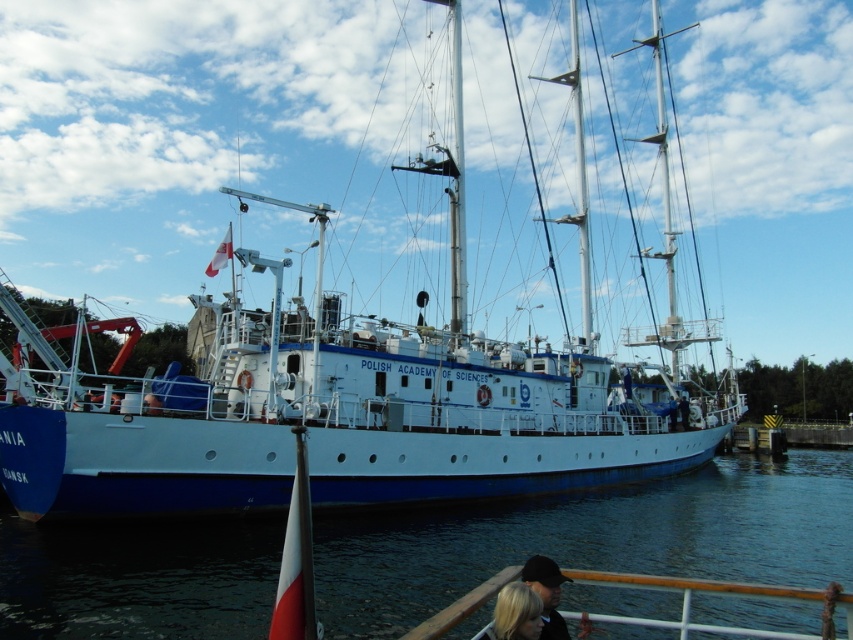
You are a photographer planning to take a photo of the white matte ship at center and the blue water at lower left. Which object will appear larger in the photo due to its height?

The white matte ship at center is much taller than the blue water at lower left, so it will appear larger in the photo.

You are standing on the pier next to the ship and want to board it. You notice the blue water at lower left and the dark blue fabric cap at lower center. Which object is closer to you as you approach the ship?

The blue water at lower left is closer to you because the dark blue fabric cap at lower center is behind it.